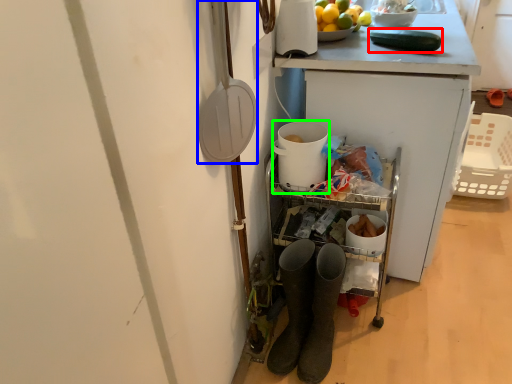
Question: Based on their relative distances, which object is farther from cucumber (highlighted by a red box)? Choose from shovel (highlighted by a blue box) and appliance (highlighted by a green box).

Choices:
 (A) shovel
 (B) appliance

Answer: (A)